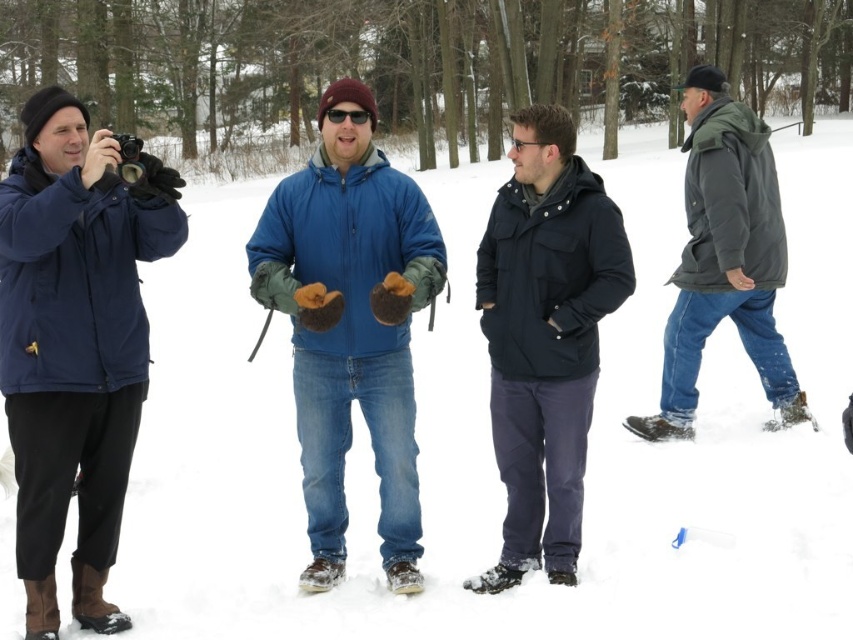
You are a photographer trying to capture a group photo. You notice the navy blue jacket at left and the dark blue matte jacket at center. Which person should move closer to the center to ensure both are equally visible in the frame?

The navy blue jacket at left should move closer to the center since it is wider than the dark blue matte jacket at center, balancing their positions for visibility.

You are standing in the snowy woods and want to take a photo of both the navy blue jacket at left and the blue fleece jacket at center. Which jacket should you adjust your camera focus on first to ensure both are in the frame?

You should focus on the navy blue jacket at left first since it is closer to the viewer than the blue fleece jacket at center, ensuring both are within the camera frame.

You are planning to buy a winter jacket for your friend who is the same size as the person wearing the navy blue jacket at left. The store has a jacket that is the same size as the dark blue matte jacket at center. Will this jacket be too small for your friend?

The navy blue jacket at left is larger in size than the dark blue matte jacket at center. Therefore, the jacket available in the store is smaller and would be too small for your friend.